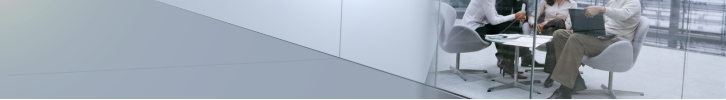
You are a GUI agent. You are given a task and a screenshot of the screen. Output one action in this format:
    pyautogui.click(x=<x>, y=<y>)
    Task: Click on the table leg
    
    Given the screenshot: What is the action you would take?
    pyautogui.click(x=515, y=60)